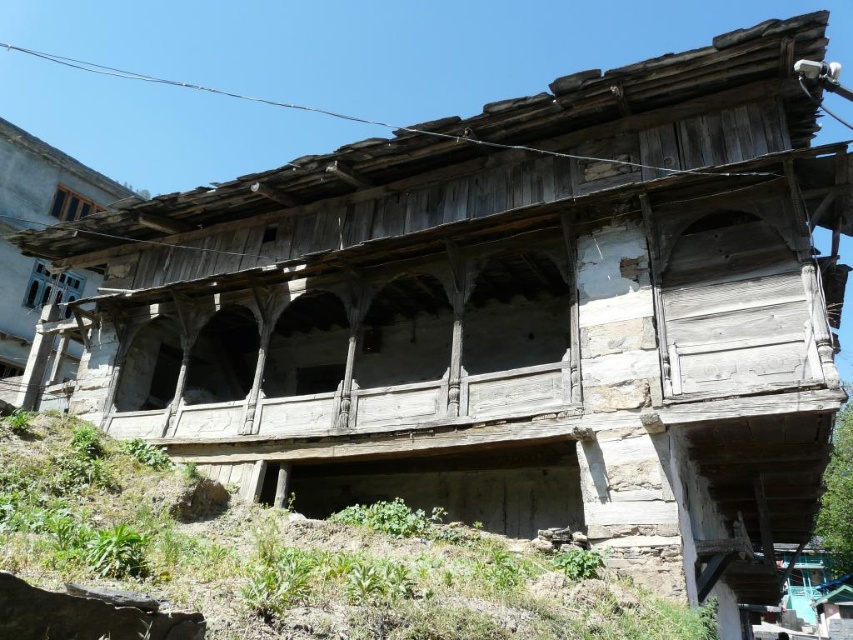
Question: Among these objects, which one is nearest to the camera?

Choices:
 (A) weathered stone hillside at lower center
 (B) blue painted wood window at upper left

Answer: (A)

Question: Where is weathered stone hillside at lower center located in relation to blue painted wood window at upper left in the image?

Choices:
 (A) above
 (B) below

Answer: (B)

Question: Is weathered stone hillside at lower center wider than blue painted wood window at upper left?

Choices:
 (A) yes
 (B) no

Answer: (A)

Question: Is weathered stone hillside at lower center to the left of blue painted wood window at upper left from the viewer's perspective?

Choices:
 (A) yes
 (B) no

Answer: (B)